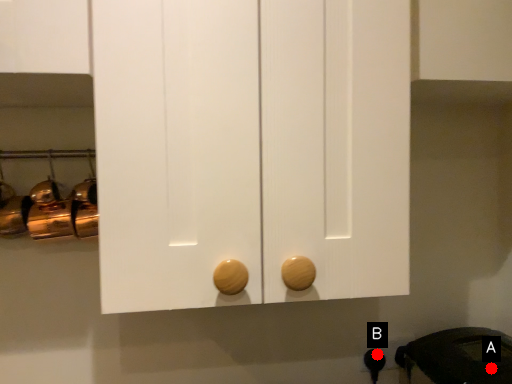
Question: Two points are circled on the image, labeled by A and B beside each circle. Which point is farther to the camera?

Choices:
 (A) A is further
 (B) B is further

Answer: (B)